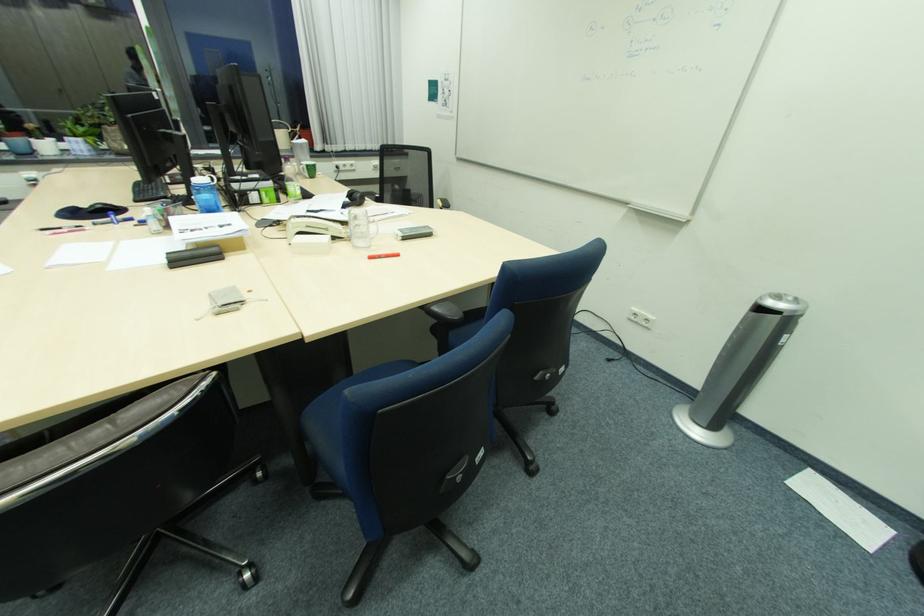
You are a GUI agent. You are given a task and a screenshot of the screen. Output one action in this format:
    pyautogui.click(x=<x>, y=<y>)
    Task: Click on the black glasses case
    
    Given the screenshot: What is the action you would take?
    pyautogui.click(x=193, y=256)